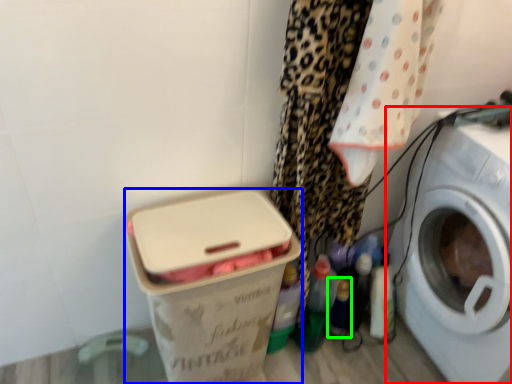
Question: Which object is positioned farthest from washing machine (highlighted by a red box)? Select from box (highlighted by a blue box) and bottle (highlighted by a green box).

Choices:
 (A) box
 (B) bottle

Answer: (A)